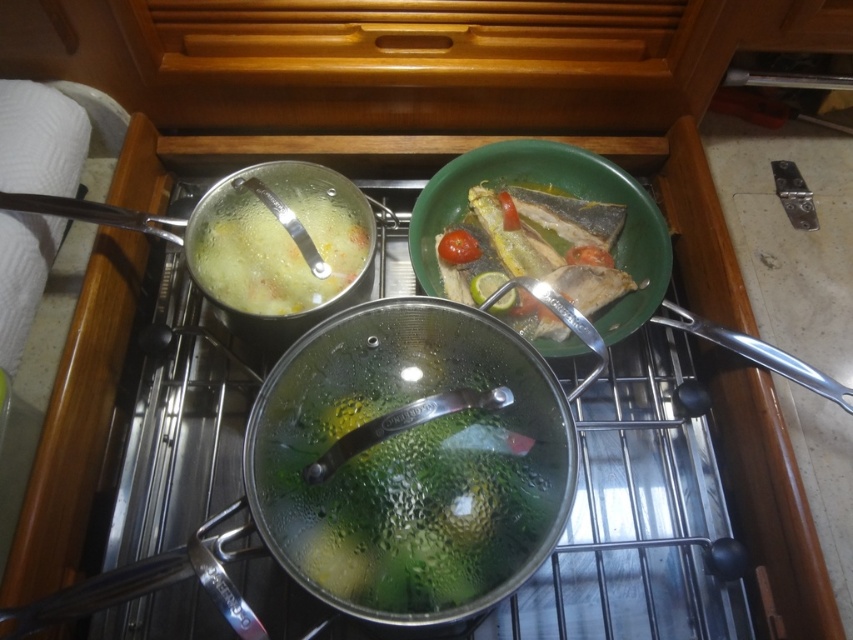
You are a chef standing in front of the stovetop with two points marked on the pots. Point A is at coordinates point (x=534, y=243) and Point B is at point (x=227, y=243). Which point is closer to you?

Point A at point (x=534, y=243) is closer to you because it is further to the viewer than point B at point (x=227, y=243).

You are a chef preparing a meal and need to place a 8 inch long spatula between the green matte fish at center and the translucent glass soup at upper left. Is there enough space to fit the spatula between them?

The green matte fish at center and the translucent glass soup at upper left are 7.81 inches apart from each other. Since the spatula is 8 inches long, there isn not enough space to fit it between them.

You are a chef trying to reach the point at coordinates point (524, 324) in the image. You have a 24 inch long spoon. Can you safely reach that point with your spoon without moving your current position?

The point (524, 324) is 26.97 inches away from the camera, so the spoon is 24 inches long, so you cannot reach it.